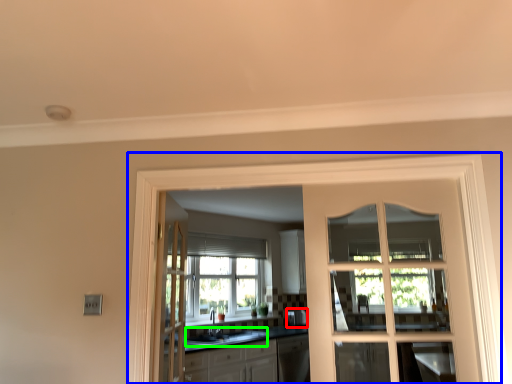
Question: Estimate the real-world distances between objects in this image. Which object is farther from appliance (highlighted by a red box), window frame (highlighted by a blue box) or sink (highlighted by a green box)?

Choices:
 (A) window frame
 (B) sink

Answer: (A)